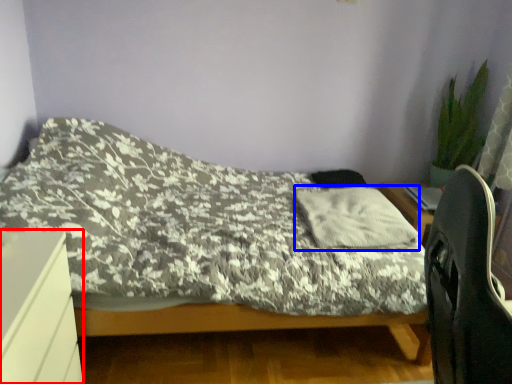
Question: Which of the following is the closest to the observer, desk (highlighted by a red box) or pillow (highlighted by a blue box)?

Choices:
 (A) desk
 (B) pillow

Answer: (A)